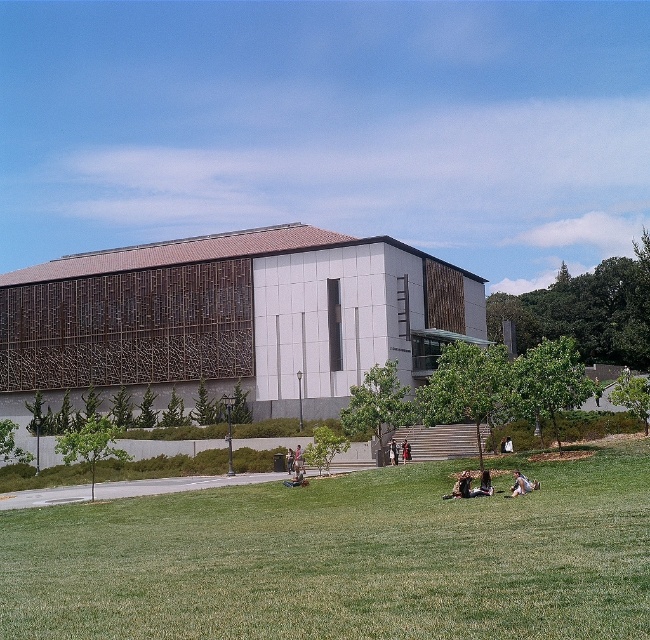
Question: Which point is closer to the camera?

Choices:
 (A) (294, 464)
 (B) (517, 486)

Answer: (B)

Question: Which object appears closest to the camera in this image?

Choices:
 (A) green grass at lower center
 (B) denim jacket at center

Answer: (A)

Question: In this image, where is dark brown leather jacket at center located relative to denim jacket at lower center?

Choices:
 (A) above
 (B) below

Answer: (B)

Question: Can you confirm if light brown fabric person at lower right is positioned to the right of denim jacket at center?

Choices:
 (A) no
 (B) yes

Answer: (B)

Question: Can you confirm if denim jacket at center is positioned below dark brown leather jacket at center?

Choices:
 (A) no
 (B) yes

Answer: (B)

Question: Among these points, which one is farthest from the camera?

Choices:
 (A) (292, 470)
 (B) (395, 449)

Answer: (B)